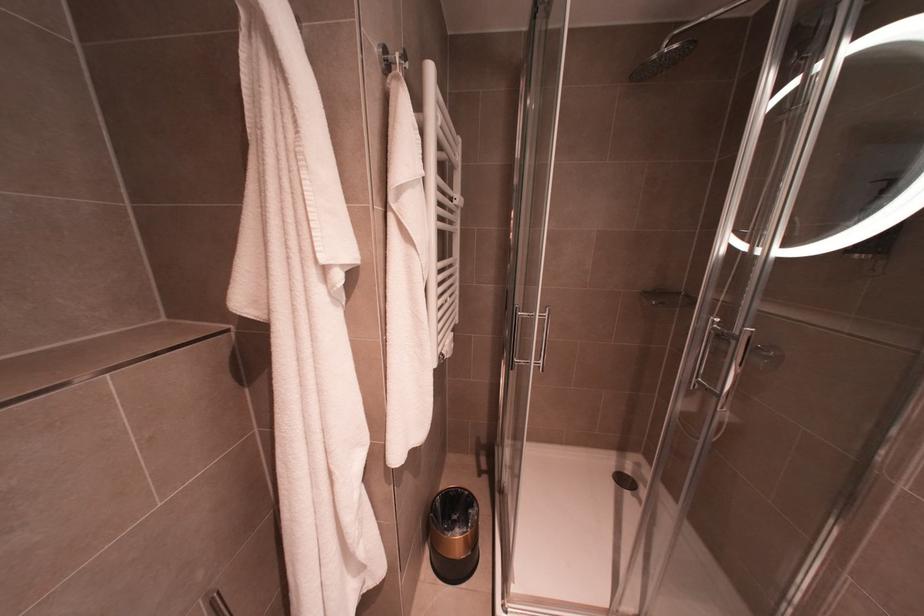
This screenshot has width=924, height=616. I want to click on metal towel hook, so click(x=394, y=60).